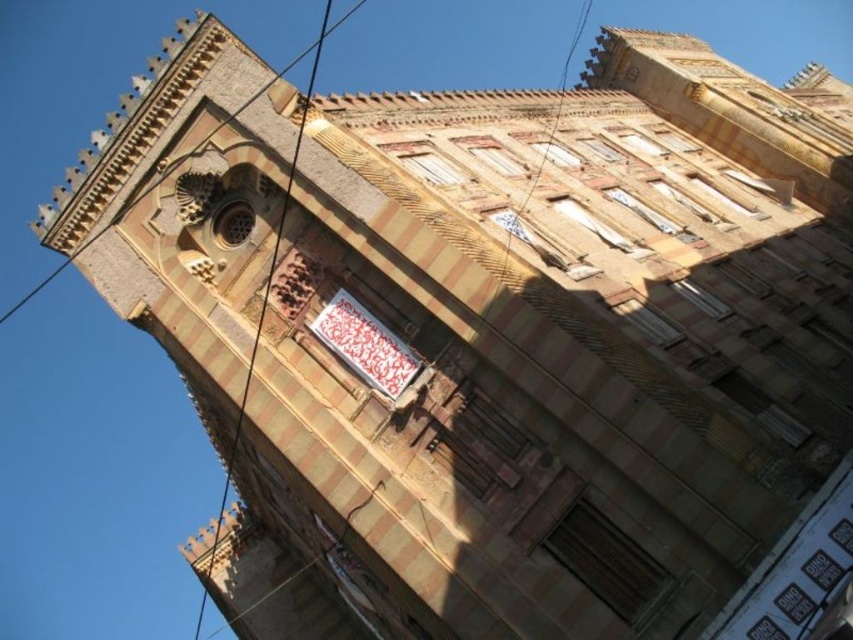
You are standing in front of the building and want to reach the point at coordinates point (381, 392). Given that the building is 100 meters away from you, can you estimate how far you need to walk to reach that point?

The point (381, 392) is 61.59 meters away from the camera, so you need to walk approximately 61.59 meters to reach it.

You are standing directly in front of the multi story building. You want to place a new sign exactly at the same position as the white fabric sign at center. What coordinates should you use?

The white fabric sign at center is located at coordinates point (364, 344), so you should place the new sign at those coordinates.

You are standing in front of the building and want to read the text on the white fabric sign at center. Based on the distance provided, can you estimate whether you can read the text clearly without any optical aid?

The white fabric sign at center is located 60.72 meters away from the viewer. At this distance, it would be challenging to read the text clearly without using optical aids like binoculars or a telescope.